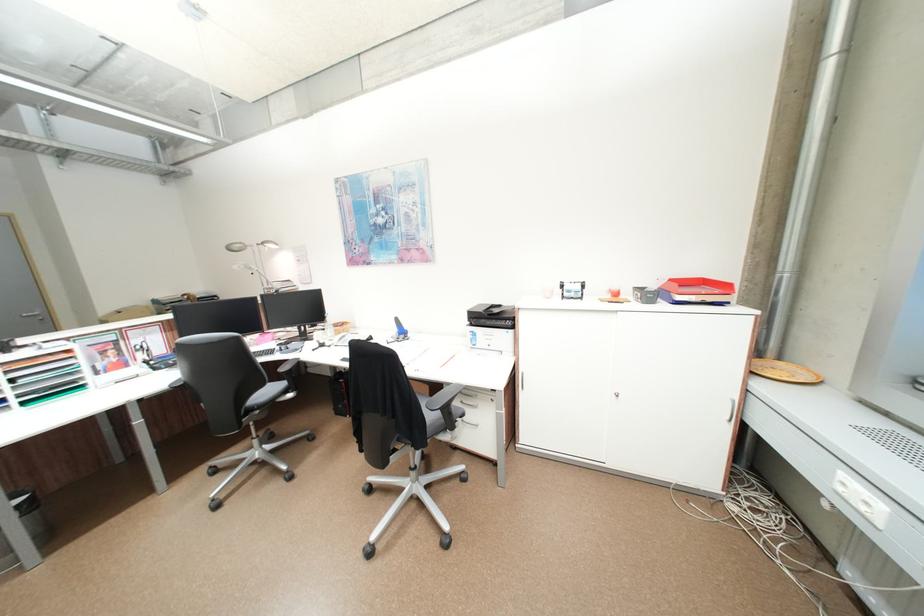
Which object does [21,528] point to?

It refers to a trash can.